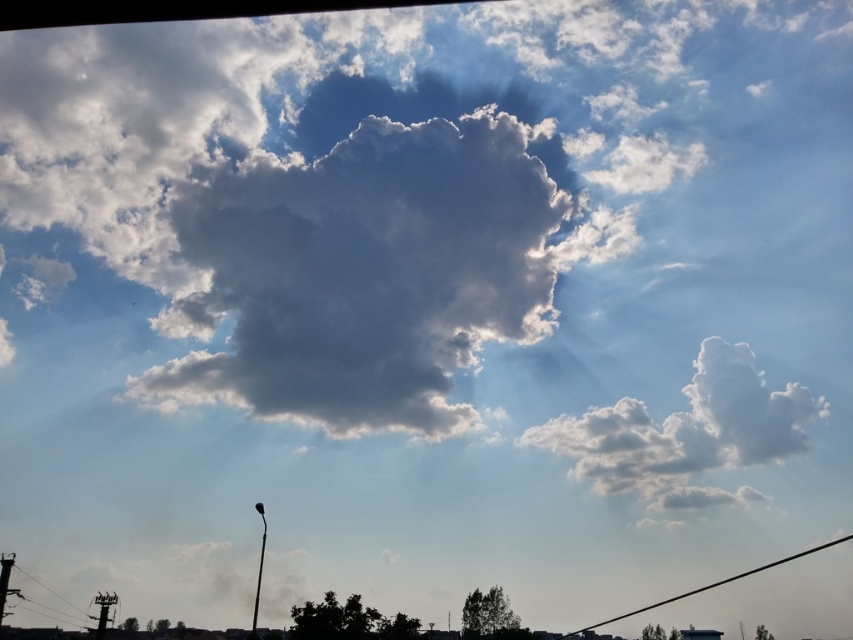
Is white fluffy cloud at center thinner than white fluffy cloud at right?

Indeed, white fluffy cloud at center has a lesser width compared to white fluffy cloud at right.

Between white fluffy cloud at center and white fluffy cloud at right, which one has less height?

white fluffy cloud at right is shorter.

The image size is (853, 640). Describe the element at coordinates (364, 273) in the screenshot. I see `white fluffy cloud at center` at that location.

The image size is (853, 640). In order to click on white fluffy cloud at center in this screenshot , I will do `click(364, 273)`.

Who is shorter, black wire at lower right or black wire at lower left?

black wire at lower right is shorter.

Is black wire at lower right above black wire at lower left?

Actually, black wire at lower right is below black wire at lower left.

Is point (786, 557) behind point (19, 589)?

Yes, it is.

The width and height of the screenshot is (853, 640). I want to click on black wire at lower right, so click(711, 586).

Between white fluffy cloud at right and black wire at lower right, which one is positioned higher?

Positioned higher is white fluffy cloud at right.

Between white fluffy cloud at right and black wire at lower right, which one has less height?

Standing shorter between the two is black wire at lower right.

The width and height of the screenshot is (853, 640). What do you see at coordinates (686, 433) in the screenshot? I see `white fluffy cloud at right` at bounding box center [686, 433].

I want to click on white fluffy cloud at right, so click(x=686, y=433).